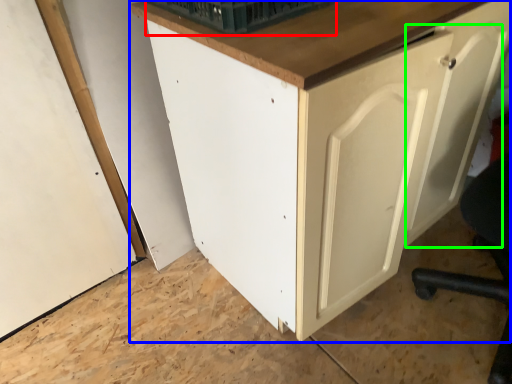
Question: Which object is the farthest from basket (highlighted by a red box)? Choose among these: cabinetry (highlighted by a blue box) or door (highlighted by a green box).

Choices:
 (A) cabinetry
 (B) door

Answer: (B)